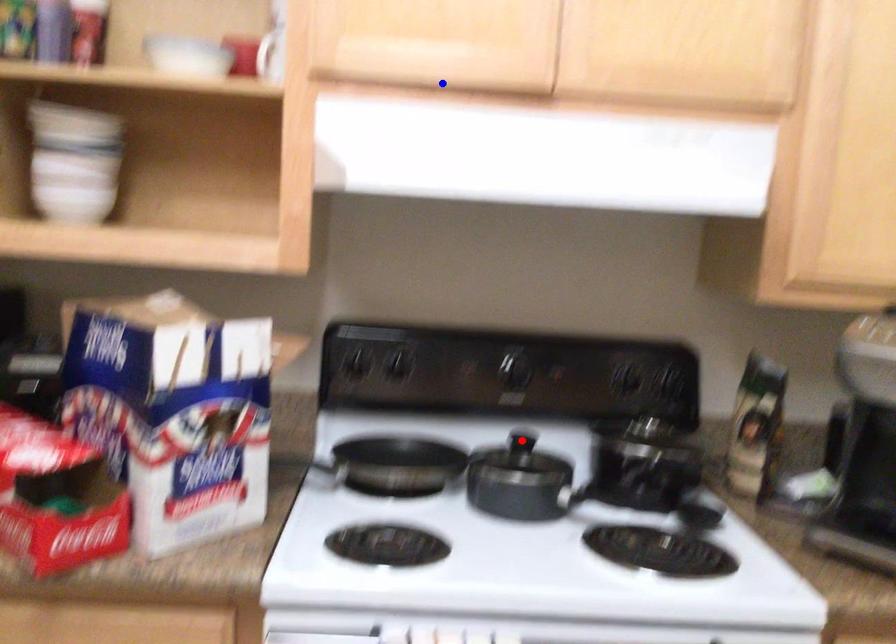
Question: Which of the two points in the image is closer to the camera?

Choices:
 (A) Blue point is closer.
 (B) Red point is closer.

Answer: (A)